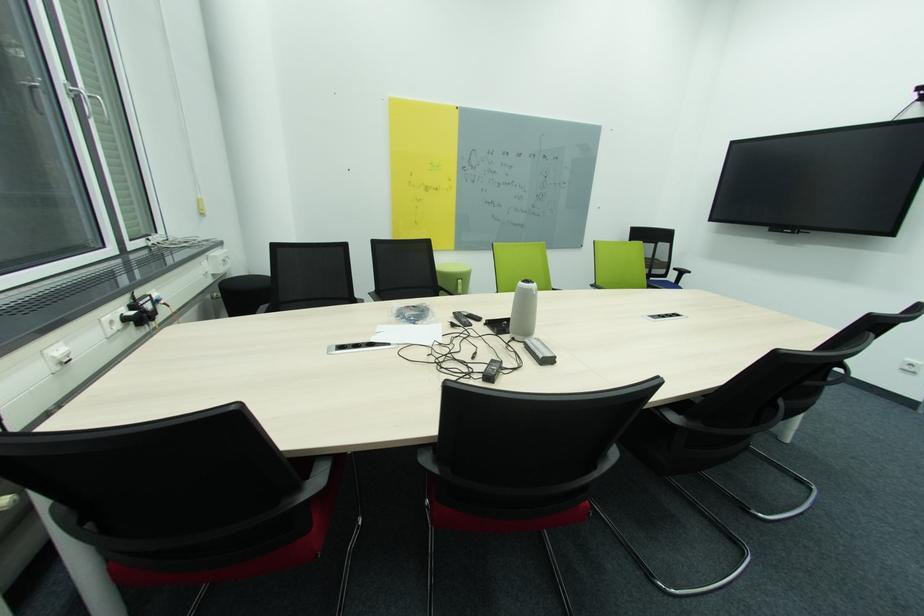
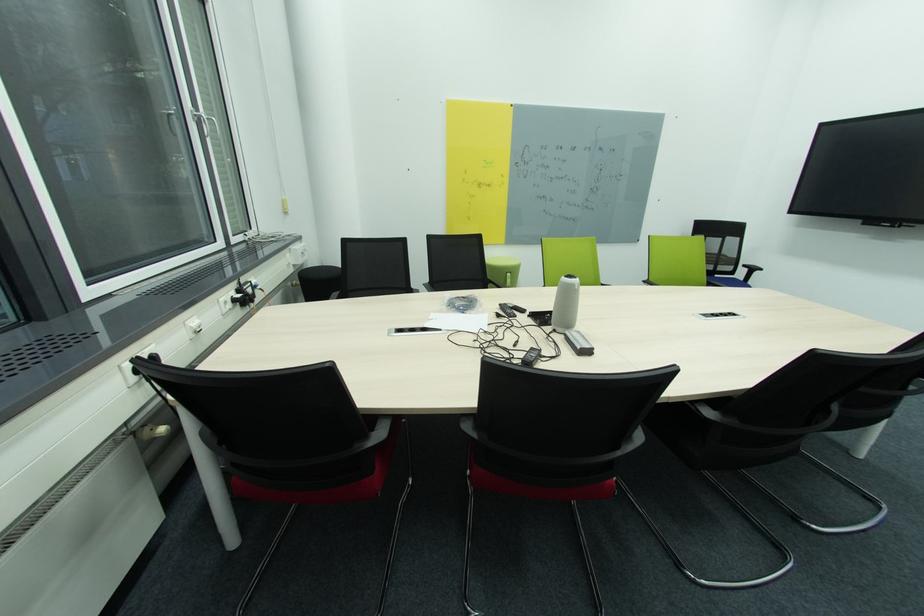
Find the pixel in the second image that matches [521,339] in the first image.

(563, 331)